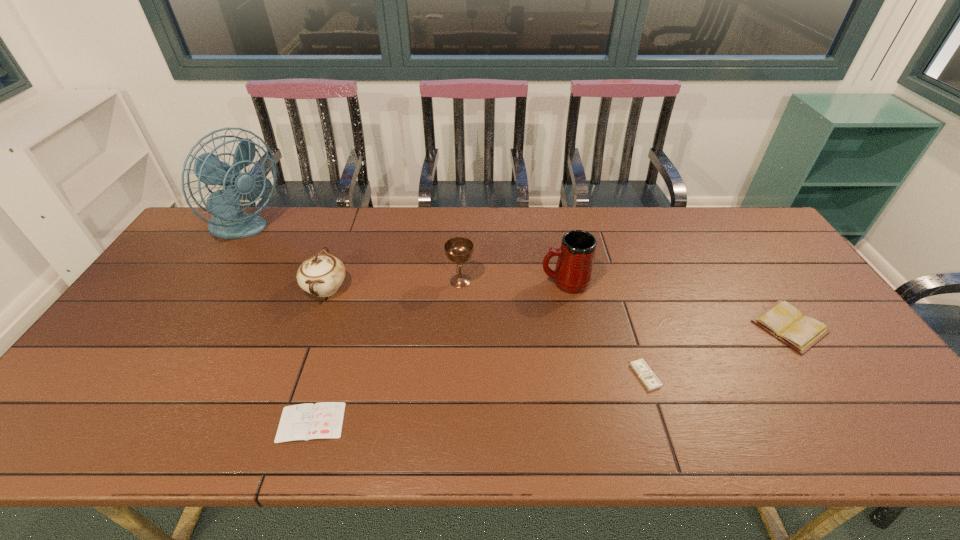
Image resolution: width=960 pixels, height=540 pixels. I want to click on the leftmost object, so click(228, 222).

Identify the location of fan. Image resolution: width=960 pixels, height=540 pixels. (x=228, y=222).

Image resolution: width=960 pixels, height=540 pixels. Identify the location of mug. (573, 273).

Find the location of `the sixth shortest object`. the sixth shortest object is located at coordinates (573, 273).

I want to click on chalice, so click(458, 249).

Locate an element on the screen. The height and width of the screenshot is (540, 960). chinaware is located at coordinates (322, 274).

Identify the location of the right diary. The height and width of the screenshot is (540, 960). (784, 321).

Find the location of a particular element. the farther diary is located at coordinates (784, 321).

This screenshot has width=960, height=540. In order to click on money in this screenshot , I will do `click(643, 371)`.

This screenshot has height=540, width=960. In order to click on the second shortest object in this screenshot , I will do `click(643, 371)`.